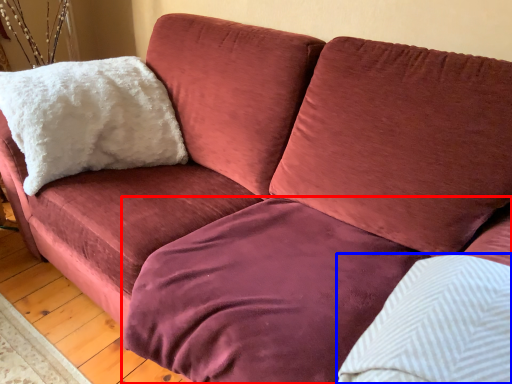
Question: Which object appears farthest to the camera in this image, bedding (highlighted by a red box) or pillow (highlighted by a blue box)?

Choices:
 (A) bedding
 (B) pillow

Answer: (A)